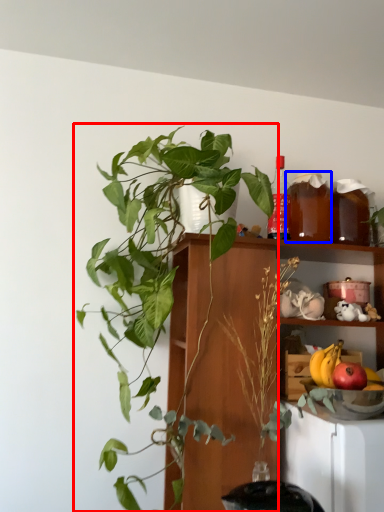
Question: Which object appears farthest to the camera in this image, houseplant (highlighted by a red box) or beverage (highlighted by a blue box)?

Choices:
 (A) houseplant
 (B) beverage

Answer: (B)